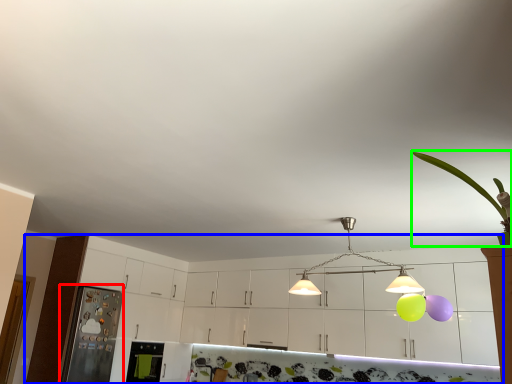
Question: Which is farther away from appliance (highlighted by a red box)? cabinetry (highlighted by a blue box) or plant (highlighted by a green box)?

Choices:
 (A) cabinetry
 (B) plant

Answer: (B)